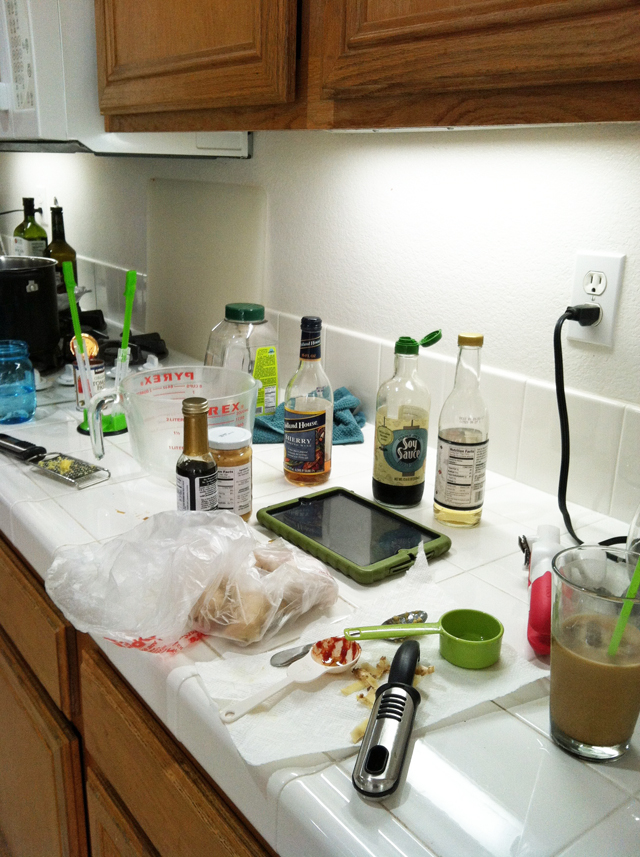
Where is `brown cabnets`? The image size is (640, 857). brown cabnets is located at coordinates (155, 794).